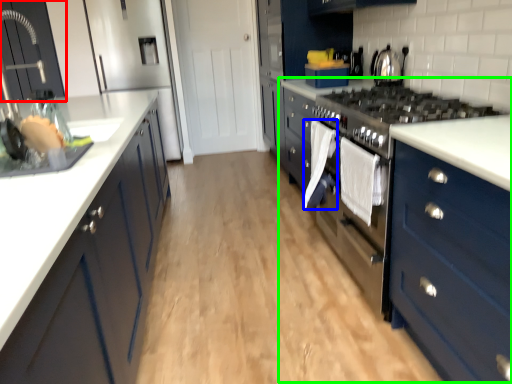
Question: Which object is the farthest from cabinetry (highlighted by a red box)? Choose among these: clothe (highlighted by a blue box) or dresser (highlighted by a green box).

Choices:
 (A) clothe
 (B) dresser

Answer: (B)